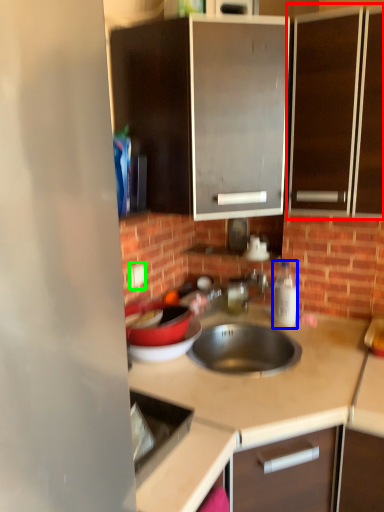
Question: Considering the real-world distances, which object is farthest from cabinetry (highlighted by a red box)? bottle (highlighted by a blue box) or electric outlet (highlighted by a green box)?

Choices:
 (A) bottle
 (B) electric outlet

Answer: (B)